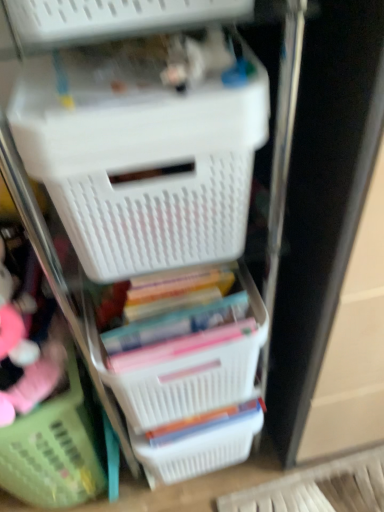
The image size is (384, 512). What do you see at coordinates (199, 442) in the screenshot?
I see `white plastic basket at lower center, which is the 3th basket from left to right` at bounding box center [199, 442].

Describe the element at coordinates (56, 447) in the screenshot. I see `green plastic basket at lower left, the 1th basket from the left` at that location.

What do you see at coordinates (185, 373) in the screenshot? I see `white plastic basket at center, which is the second basket in right-to-left order` at bounding box center [185, 373].

The height and width of the screenshot is (512, 384). Identify the location of white plastic basket at upper center. coord(145,149).

This screenshot has width=384, height=512. What do you see at coordinates (145, 149) in the screenshot?
I see `white plastic basket at upper center` at bounding box center [145, 149].

This screenshot has height=512, width=384. Identify the location of white plastic basket at lower center, which is the 3th basket from left to right. (199, 442).

From a real-world perspective, between green plastic basket at lower left, the 1th basket from the left, and white plastic basket at lower center, the first basket positioned from the right, who is vertically lower?

white plastic basket at lower center, the first basket positioned from the right.

In the scene shown: Can you confirm if green plastic basket at lower left, the 3th basket when ordered from right to left, is shorter than white plastic basket at lower center, which is the 3th basket from left to right?

No, green plastic basket at lower left, the 3th basket when ordered from right to left, is not shorter than white plastic basket at lower center, which is the 3th basket from left to right.

Is green plastic basket at lower left, the 3th basket when ordered from right to left, bigger or smaller than white plastic basket at lower center, the first basket positioned from the right?

Considering their sizes, green plastic basket at lower left, the 3th basket when ordered from right to left, takes up more space than white plastic basket at lower center, the first basket positioned from the right.

Would you say green plastic basket at lower left, the 3th basket when ordered from right to left, is outside white plastic basket at lower center, which is the 3th basket from left to right?

Indeed, green plastic basket at lower left, the 3th basket when ordered from right to left, is completely outside white plastic basket at lower center, which is the 3th basket from left to right.

How many degrees apart are the facing directions of white plastic basket at lower center, the first basket positioned from the right, and white plastic basket at center, which is the second basket in right-to-left order?

white plastic basket at lower center, the first basket positioned from the right, and white plastic basket at center, which is the second basket in right-to-left order, are facing 0.000424 degrees away from each other.

Is white plastic basket at lower center, which is the 3th basket from left to right, surrounding white plastic basket at center, which is the second basket in right-to-left order?

No, white plastic basket at center, which is the second basket in right-to-left order, is located outside of white plastic basket at lower center, which is the 3th basket from left to right.

Is white plastic basket at lower center, the first basket positioned from the right, in contact with white plastic basket at center, which is the second basket in right-to-left order?

No, white plastic basket at lower center, the first basket positioned from the right, is not touching white plastic basket at center, which is the second basket in right-to-left order.

From a real-world perspective, who is located higher, white plastic basket at lower center, which is the 3th basket from left to right, or white plastic basket at center, placed as the second basket when sorted from left to right?

white plastic basket at center, placed as the second basket when sorted from left to right.

In the scene shown: Does white plastic basket at center, which is the second basket in right-to-left order, turn towards white plastic basket at lower center, which is the 3th basket from left to right?

No, white plastic basket at center, which is the second basket in right-to-left order, is not turned towards white plastic basket at lower center, which is the 3th basket from left to right.

From the image's perspective, which basket is the 1st one below the white plastic basket at center, placed as the second basket when sorted from left to right? Please provide its 2D coordinates.

[(199, 442)]

From a real-world perspective, is white plastic basket at lower center, the first basket positioned from the right, positioned under white plastic basket at upper center based on gravity?

Indeed, from a real-world perspective, white plastic basket at lower center, the first basket positioned from the right, is positioned beneath white plastic basket at upper center.

Which object is closer to the camera taking this photo, white plastic basket at lower center, the first basket positioned from the right, or white plastic basket at upper center?

Positioned in front is white plastic basket at upper center.

From the image's perspective, between white plastic basket at lower center, the first basket positioned from the right, and white plastic basket at upper center, who is located below?

white plastic basket at lower center, the first basket positioned from the right, appears lower in the image.

Based on their sizes in the image, would you say white plastic basket at lower center, the first basket positioned from the right, is bigger or smaller than white plastic basket at upper center?

white plastic basket at lower center, the first basket positioned from the right, is smaller than white plastic basket at upper center.

From a real-world perspective, is white plastic basket at upper center on top of green plastic basket at lower left, the 3th basket when ordered from right to left?

Yes, from a real-world perspective, white plastic basket at upper center is on top of green plastic basket at lower left, the 3th basket when ordered from right to left.

Which of these two, white plastic basket at upper center or green plastic basket at lower left, the 3th basket when ordered from right to left, stands taller?

Standing taller between the two is green plastic basket at lower left, the 3th basket when ordered from right to left.

Considering their positions, is white plastic basket at upper center located in front of or behind green plastic basket at lower left, the 3th basket when ordered from right to left?

Visually, white plastic basket at upper center is located in front of green plastic basket at lower left, the 3th basket when ordered from right to left.

Is white plastic basket at upper center positioned far away from white plastic basket at center, which is the second basket in right-to-left order?

white plastic basket at upper center is actually quite close to white plastic basket at center, which is the second basket in right-to-left order.

Does white plastic basket at upper center have a greater width compared to white plastic basket at center, which is the second basket in right-to-left order?

Yes.

From the image's perspective, which one is positioned higher, white plastic basket at upper center or white plastic basket at center, which is the second basket in right-to-left order?

white plastic basket at upper center.

Consider the image. In terms of height, does white plastic basket at upper center look taller or shorter compared to white plastic basket at center, which is the second basket in right-to-left order?

white plastic basket at upper center is taller than white plastic basket at center, which is the second basket in right-to-left order.

Considering the sizes of objects white plastic basket at upper center and white plastic basket at lower center, the first basket positioned from the right, in the image provided, who is thinner, white plastic basket at upper center or white plastic basket at lower center, the first basket positioned from the right,?

white plastic basket at lower center, the first basket positioned from the right, is thinner.

Consider the image. Is white plastic basket at upper center outside of white plastic basket at lower center, which is the 3th basket from left to right?

Yes, white plastic basket at upper center is located beyond the bounds of white plastic basket at lower center, which is the 3th basket from left to right.

Is white plastic basket at lower center, the first basket positioned from the right, at the back of white plastic basket at upper center?

No, white plastic basket at lower center, the first basket positioned from the right, is not at the back of white plastic basket at upper center.

Which of these two, white plastic basket at upper center or white plastic basket at lower center, which is the 3th basket from left to right, stands taller?

white plastic basket at upper center.

The width and height of the screenshot is (384, 512). What are the coordinates of `the 1st basket above the green plastic basket at lower left, the 1th basket from the left (from the image's perspective)` in the screenshot? It's located at (199, 442).

Where is `basket that is the 2nd one when counting backward from the white plastic basket at center, which is the second basket in right-to-left order`? basket that is the 2nd one when counting backward from the white plastic basket at center, which is the second basket in right-to-left order is located at coordinates (199, 442).

Estimate the real-world distances between objects in this image. Which object is closer to white plastic basket at lower center, which is the 3th basket from left to right, green plastic basket at lower left, the 3th basket when ordered from right to left, or white plastic basket at center, which is the second basket in right-to-left order?

white plastic basket at center, which is the second basket in right-to-left order, is positioned closer to the anchor white plastic basket at lower center, which is the 3th basket from left to right.

Based on their spatial positions, is white plastic basket at upper center or green plastic basket at lower left, the 3th basket when ordered from right to left, closer to white plastic basket at center, which is the second basket in right-to-left order?

white plastic basket at upper center.

Looking at the image, which one is located further to white plastic basket at upper center, white plastic basket at center, placed as the second basket when sorted from left to right, or white plastic basket at lower center, the first basket positioned from the right?

white plastic basket at lower center, the first basket positioned from the right.

From the image, which object appears to be nearer to green plastic basket at lower left, the 1th basket from the left, white plastic basket at lower center, which is the 3th basket from left to right, or white plastic basket at center, which is the second basket in right-to-left order?

white plastic basket at lower center, which is the 3th basket from left to right.

From the image, which object appears to be nearer to white plastic basket at lower center, which is the 3th basket from left to right, white plastic basket at upper center or green plastic basket at lower left, the 1th basket from the left?

Based on the image, green plastic basket at lower left, the 1th basket from the left, appears to be nearer to white plastic basket at lower center, which is the 3th basket from left to right.

Considering their positions, is white plastic basket at center, placed as the second basket when sorted from left to right, positioned closer to green plastic basket at lower left, the 1th basket from the left, than white plastic basket at lower center, which is the 3th basket from left to right?

Based on the image, white plastic basket at lower center, which is the 3th basket from left to right, appears to be nearer to green plastic basket at lower left, the 1th basket from the left.

Considering their positions, is green plastic basket at lower left, the 1th basket from the left, positioned further to white plastic basket at center, placed as the second basket when sorted from left to right, than white plastic basket at lower center, which is the 3th basket from left to right?

Based on the image, green plastic basket at lower left, the 1th basket from the left, appears to be further to white plastic basket at center, placed as the second basket when sorted from left to right.

Considering their positions, is white plastic basket at lower center, which is the 3th basket from left to right, positioned closer to white plastic basket at center, which is the second basket in right-to-left order, than white plastic basket at upper center?

white plastic basket at lower center, which is the 3th basket from left to right, is positioned closer to the anchor white plastic basket at center, which is the second basket in right-to-left order.

Where is `basket between green plastic basket at lower left, the 3th basket when ordered from right to left, and white plastic basket at lower center, which is the 3th basket from left to right, in the horizontal direction`? The height and width of the screenshot is (512, 384). basket between green plastic basket at lower left, the 3th basket when ordered from right to left, and white plastic basket at lower center, which is the 3th basket from left to right, in the horizontal direction is located at coordinates (185, 373).

At what (x,y) coordinates should I click in order to perform the action: click on basket between white plastic basket at upper center and white plastic basket at lower center, the first basket positioned from the right, in the vertical direction. Please return your answer as a coordinate pair (x, y). The height and width of the screenshot is (512, 384). Looking at the image, I should click on (185, 373).